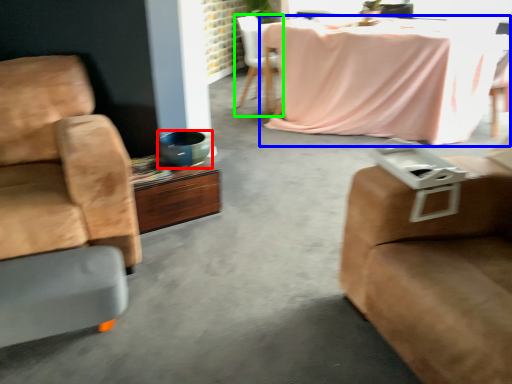
Question: Which object is positioned closest to vase (highlighted by a red box)? Select from kitchen & dining room table (highlighted by a blue box) and chair (highlighted by a green box).

Choices:
 (A) kitchen & dining room table
 (B) chair

Answer: (A)